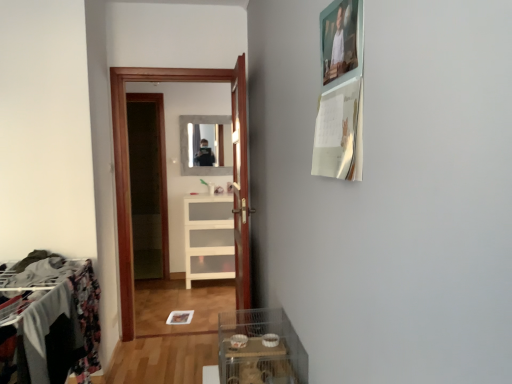
Question: Does wooden door at center come behind white glossy cabinet at center?

Choices:
 (A) yes
 (B) no

Answer: (B)

Question: Does wooden door at center have a greater height compared to white glossy cabinet at center?

Choices:
 (A) no
 (B) yes

Answer: (B)

Question: Is wooden door at center to the left of white glossy cabinet at center from the viewer's perspective?

Choices:
 (A) yes
 (B) no

Answer: (B)

Question: Considering the relative sizes of wooden door at center and white glossy cabinet at center in the image provided, is wooden door at center shorter than white glossy cabinet at center?

Choices:
 (A) yes
 (B) no

Answer: (B)

Question: From a real-world perspective, is wooden door at center over white glossy cabinet at center?

Choices:
 (A) yes
 (B) no

Answer: (A)

Question: From the image's perspective, is white glossy cabinet at center above or below wooden door at center?

Choices:
 (A) below
 (B) above

Answer: (B)

Question: Does point (116, 188) appear closer or farther from the camera than point (241, 294)?

Choices:
 (A) farther
 (B) closer

Answer: (A)

Question: From their relative heights in the image, would you say white glossy cabinet at center is taller or shorter than wooden door at center?

Choices:
 (A) tall
 (B) short

Answer: (A)

Question: Visually, is white glossy cabinet at center positioned to the left or to the right of wooden door at center?

Choices:
 (A) right
 (B) left

Answer: (B)

Question: Considering the relative positions of matte glass mirror at center and white glossy cabinet at center in the image provided, is matte glass mirror at center to the left or to the right of white glossy cabinet at center?

Choices:
 (A) right
 (B) left

Answer: (B)

Question: From the image's perspective, is matte glass mirror at center positioned above or below white glossy cabinet at center?

Choices:
 (A) below
 (B) above

Answer: (B)

Question: From a real-world perspective, is matte glass mirror at center physically located above or below white glossy cabinet at center?

Choices:
 (A) below
 (B) above

Answer: (B)

Question: Is point (187, 168) positioned closer to the camera than point (187, 218)?

Choices:
 (A) closer
 (B) farther

Answer: (B)

Question: From a real-world perspective, is metallic wire rack at left physically located above or below wooden door at center?

Choices:
 (A) above
 (B) below

Answer: (B)

Question: From the image's perspective, is metallic wire rack at left positioned above or below wooden door at center?

Choices:
 (A) below
 (B) above

Answer: (A)